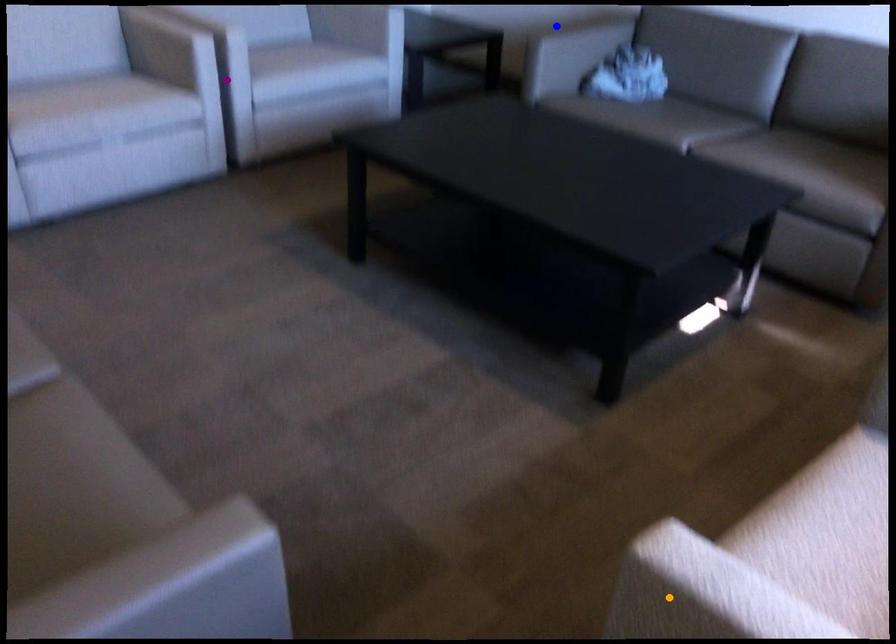
Looking at this image, order these from nearest to farthest:
A) purple point
B) orange point
C) blue point

orange point
purple point
blue point